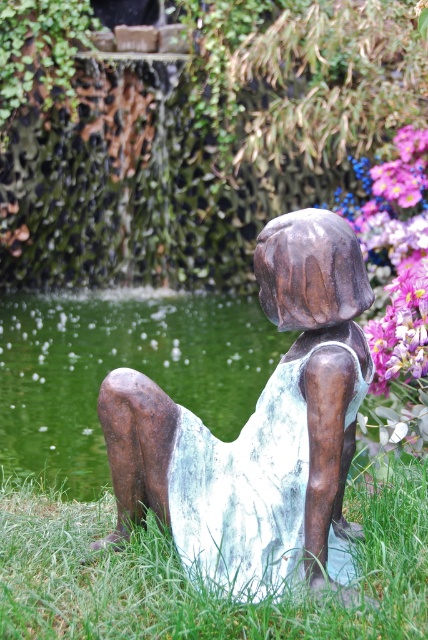
Is bronze statue at center shorter than green metallic water at lower left?

In fact, bronze statue at center may be taller than green metallic water at lower left.

Is bronze statue at center closer to the viewer compared to green metallic water at lower left?

Yes, bronze statue at center is in front of green metallic water at lower left.

Identify the location of bronze statue at center. (258, 417).

Does bronze statue at center appear on the left side of green grass at lower center?

In fact, bronze statue at center is to the right of green grass at lower center.

Describe the element at coordinates (258, 417) in the screenshot. The image size is (428, 640). I see `bronze statue at center` at that location.

Find the location of a particular element. The height and width of the screenshot is (640, 428). bronze statue at center is located at coordinates (258, 417).

Can you confirm if green grass at lower center is thinner than green metallic water at lower left?

Indeed, green grass at lower center has a lesser width compared to green metallic water at lower left.

Does green grass at lower center have a lesser height compared to green metallic water at lower left?

Yes, green grass at lower center is shorter than green metallic water at lower left.

Image resolution: width=428 pixels, height=640 pixels. What are the coordinates of `green grass at lower center` in the screenshot? It's located at (192, 580).